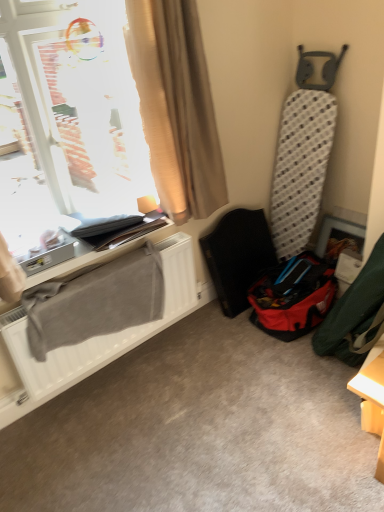
Find the location of a particular element. Image resolution: width=384 pixels, height=512 pixels. transparent glass window at upper left is located at coordinates (79, 102).

What do you see at coordinates (176, 106) in the screenshot?
I see `beige fabric curtain at upper left` at bounding box center [176, 106].

Image resolution: width=384 pixels, height=512 pixels. What do you see at coordinates (102, 335) in the screenshot?
I see `white matte radiator at lower left` at bounding box center [102, 335].

Locate an element on the screen. Image resolution: width=384 pixels, height=512 pixels. plastic textured folding chair at center right is located at coordinates (238, 256).

From a real-world perspective, which object stands above the other?

transparent glass window at upper left.

From the image's perspective, which one is positioned higher, transparent glass window at upper left or beige fabric curtain at upper left?

beige fabric curtain at upper left appears higher in the image.

Considering the sizes of objects transparent glass window at upper left and beige fabric curtain at upper left in the image provided, who is wider, transparent glass window at upper left or beige fabric curtain at upper left?

transparent glass window at upper left.

Is transparent glass window at upper left not inside beige fabric curtain at upper left?

Yes.

Does point (175, 282) come behind point (248, 306)?

That is False.

Is white matte radiator at lower left not close to plastic textured folding chair at center right?

No, there isn't a large distance between white matte radiator at lower left and plastic textured folding chair at center right.

Can you tell me how much white matte radiator at lower left and plastic textured folding chair at center right differ in facing direction?

white matte radiator at lower left and plastic textured folding chair at center right are facing 0.423 degrees away from each other.

What are the coordinates of `folding chair lying behind the white matte radiator at lower left` in the screenshot? It's located at (238, 256).

Is plastic textured folding chair at center right completely or partially outside of transparent glass window at upper left?

Yes.

Between point (234, 219) and point (58, 111), which one is positioned in front?

The point (58, 111) is closer.

Considering the relative sizes of plastic textured folding chair at center right and transparent glass window at upper left in the image provided, is plastic textured folding chair at center right smaller than transparent glass window at upper left?

Indeed, plastic textured folding chair at center right has a smaller size compared to transparent glass window at upper left.

Can you confirm if white matte radiator at lower left is wider than beige fabric curtain at upper left?

In fact, white matte radiator at lower left might be narrower than beige fabric curtain at upper left.

From the picture: Considering the relative sizes of white matte radiator at lower left and beige fabric curtain at upper left in the image provided, is white matte radiator at lower left bigger than beige fabric curtain at upper left?

Incorrect, white matte radiator at lower left is not larger than beige fabric curtain at upper left.

From the image's perspective, is white matte radiator at lower left beneath beige fabric curtain at upper left?

Yes, from the image's perspective, white matte radiator at lower left is beneath beige fabric curtain at upper left.

Considering the positions of objects white matte radiator at lower left and beige fabric curtain at upper left in the image provided, who is more to the right, white matte radiator at lower left or beige fabric curtain at upper left?

Positioned to the right is beige fabric curtain at upper left.

Considering the sizes of white matte radiator at lower left and red fabric bag at lower right in the image, is white matte radiator at lower left taller or shorter than red fabric bag at lower right?

In the image, white matte radiator at lower left appears to be shorter than red fabric bag at lower right.

Is the position of white matte radiator at lower left less distant than that of red fabric bag at lower right?

Yes, it is.

Considering the sizes of objects white matte radiator at lower left and red fabric bag at lower right in the image provided, who is thinner, white matte radiator at lower left or red fabric bag at lower right?

Thinner between the two is white matte radiator at lower left.

Is point (165, 318) positioned before point (294, 333)?

No, (165, 318) is further to viewer.

Is beige fabric curtain at upper left wider than plastic textured folding chair at center right?

Incorrect, the width of beige fabric curtain at upper left does not surpass that of plastic textured folding chair at center right.

Relative to plastic textured folding chair at center right, is beige fabric curtain at upper left in front or behind?

→ Visually, beige fabric curtain at upper left is located in front of plastic textured folding chair at center right.

Is beige fabric curtain at upper left aimed at plastic textured folding chair at center right?

No, beige fabric curtain at upper left does not turn towards plastic textured folding chair at center right.

In the scene shown: Choose the correct answer: Is beige fabric curtain at upper left inside plastic textured folding chair at center right or outside it?

beige fabric curtain at upper left lies outside plastic textured folding chair at center right.

Does beige fabric curtain at upper left have a greater width compared to white matte radiator at lower left?

Yes.

Can you tell me how much beige fabric curtain at upper left and white matte radiator at lower left differ in facing direction?

1.37 degrees separate the facing orientations of beige fabric curtain at upper left and white matte radiator at lower left.

From the image's perspective, which is above, beige fabric curtain at upper left or white matte radiator at lower left?

beige fabric curtain at upper left, from the image's perspective.

The width and height of the screenshot is (384, 512). What are the coordinates of `curtain on the right of transparent glass window at upper left` in the screenshot? It's located at [176, 106].

Where is `folding chair beneath the white matte radiator at lower left (from a real-world perspective)`? This screenshot has width=384, height=512. folding chair beneath the white matte radiator at lower left (from a real-world perspective) is located at coordinates (238, 256).

From the image, which object appears to be farther from white matte radiator at lower left, beige fabric curtain at upper left or transparent glass window at upper left?

transparent glass window at upper left is further to white matte radiator at lower left.

Which object lies nearer to the anchor point white matte radiator at lower left, red fabric bag at lower right or plastic textured folding chair at center right?

plastic textured folding chair at center right is positioned closer to the anchor white matte radiator at lower left.

Based on their spatial positions, is red fabric bag at lower right or plastic textured folding chair at center right further from transparent glass window at upper left?

red fabric bag at lower right.

When comparing their distances from transparent glass window at upper left, does red fabric bag at lower right or beige fabric curtain at upper left seem closer?

Among the two, beige fabric curtain at upper left is located nearer to transparent glass window at upper left.

Consider the image. Estimate the real-world distances between objects in this image. Which object is closer to plastic textured folding chair at center right, white matte radiator at lower left or beige fabric curtain at upper left?

white matte radiator at lower left is positioned closer to the anchor plastic textured folding chair at center right.

When comparing their distances from white matte radiator at lower left, does beige fabric curtain at upper left or plastic textured folding chair at center right seem closer?

plastic textured folding chair at center right is positioned closer to the anchor white matte radiator at lower left.

Which object lies further to the anchor point transparent glass window at upper left, plastic textured folding chair at center right or red fabric bag at lower right?

red fabric bag at lower right.

In the scene shown: From the image, which object appears to be farther from beige fabric curtain at upper left, white matte radiator at lower left or plastic textured folding chair at center right?

white matte radiator at lower left is further to beige fabric curtain at upper left.

The image size is (384, 512). I want to click on radiator situated between transparent glass window at upper left and red fabric bag at lower right from left to right, so click(102, 335).

The width and height of the screenshot is (384, 512). I want to click on radiator between transparent glass window at upper left and plastic textured folding chair at center right in the horizontal direction, so click(102, 335).

Where is `curtain between white matte radiator at lower left and red fabric bag at lower right from left to right`? Image resolution: width=384 pixels, height=512 pixels. curtain between white matte radiator at lower left and red fabric bag at lower right from left to right is located at coordinates (176, 106).

Image resolution: width=384 pixels, height=512 pixels. Identify the location of folding chair that lies between beige fabric curtain at upper left and red fabric bag at lower right from top to bottom. (238, 256).